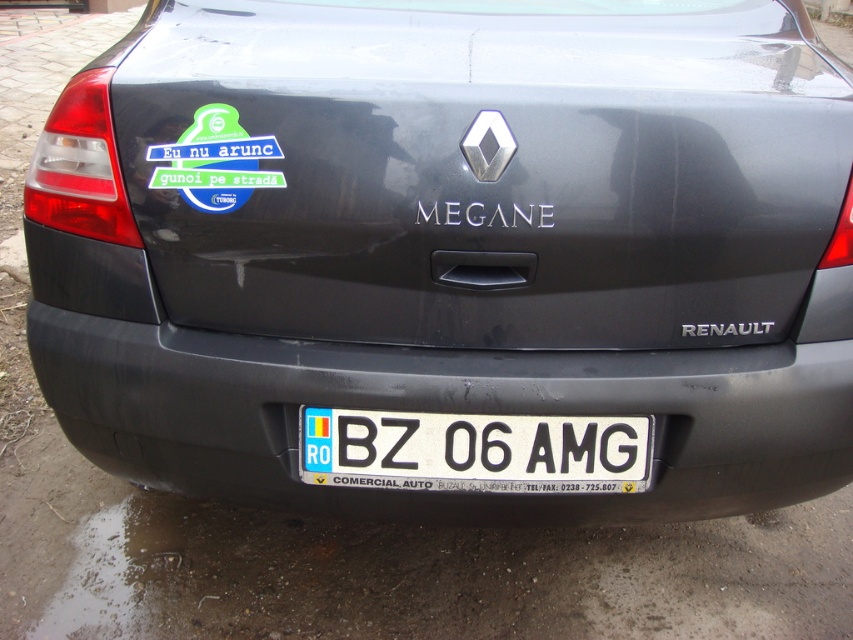
Does point (757, 598) lie in front of point (451, 435)?

No.

Is brown dirt at lower center further to the viewer compared to white plastic license plate at center?

Yes, brown dirt at lower center is behind white plastic license plate at center.

The width and height of the screenshot is (853, 640). What are the coordinates of `brown dirt at lower center` in the screenshot? It's located at (438, 577).

Can you confirm if black matte bumper at lower center is bigger than white plastic license plate at center?

Indeed, black matte bumper at lower center has a larger size compared to white plastic license plate at center.

Between black matte bumper at lower center and white plastic license plate at center, which one has more height?

black matte bumper at lower center

The width and height of the screenshot is (853, 640). Find the location of `black matte bumper at lower center`. black matte bumper at lower center is located at coordinates (442, 412).

Where is `black matte bumper at lower center`? Image resolution: width=853 pixels, height=640 pixels. black matte bumper at lower center is located at coordinates point(442,412).

Is black matte bumper at lower center thinner than brown dirt at lower center?

Indeed, black matte bumper at lower center has a lesser width compared to brown dirt at lower center.

Is black matte bumper at lower center above brown dirt at lower center?

Indeed, black matte bumper at lower center is positioned over brown dirt at lower center.

Where is `black matte bumper at lower center`? Image resolution: width=853 pixels, height=640 pixels. black matte bumper at lower center is located at coordinates (442, 412).